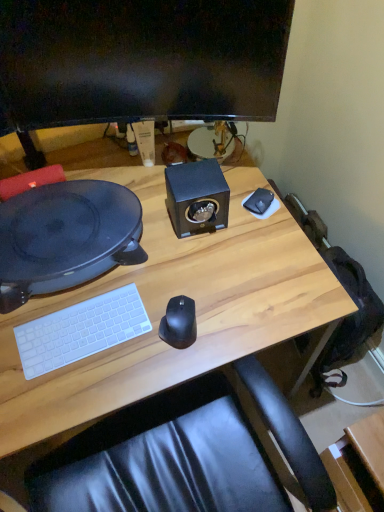
Locate an element on the screen. unoccupied space behind black matte speaker at center is located at coordinates (190, 158).